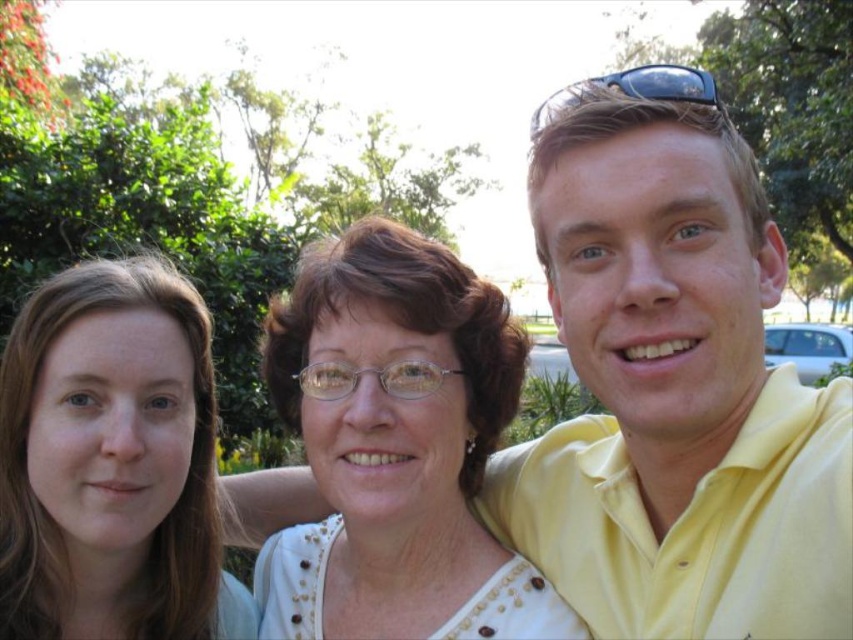
Can you confirm if white textured blouse at center is shorter than black plastic sunglasses at upper right?

Correct, white textured blouse at center is not as tall as black plastic sunglasses at upper right.

Who is more forward, (x=376, y=400) or (x=554, y=106)?

Point (x=554, y=106) is in front.

At what (x,y) coordinates should I click in order to perform the action: click on white textured blouse at center. Please return your answer as a coordinate pair (x, y). Looking at the image, I should click on (396, 448).

Does yellow satin shirt at upper right have a larger size compared to smooth skin face at left?

Yes, yellow satin shirt at upper right is bigger than smooth skin face at left.

Who is taller, yellow satin shirt at upper right or smooth skin face at left?

yellow satin shirt at upper right is taller.

Find the location of a particular element. The width and height of the screenshot is (853, 640). yellow satin shirt at upper right is located at coordinates (674, 396).

Image resolution: width=853 pixels, height=640 pixels. I want to click on yellow satin shirt at upper right, so click(x=674, y=396).

Consider the image. Is yellow satin shirt at upper right positioned behind black plastic sunglasses at upper right?

That is False.

Does yellow satin shirt at upper right have a larger size compared to black plastic sunglasses at upper right?

No.

Looking at this image, who is more forward, (659, 563) or (685, 84)?

Point (685, 84)

Locate an element on the screen. yellow satin shirt at upper right is located at coordinates tap(674, 396).